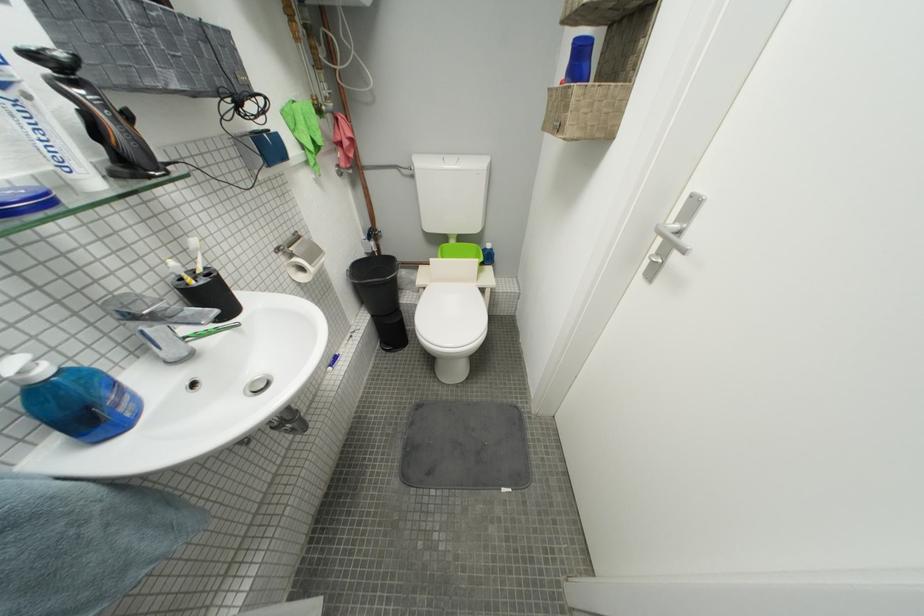
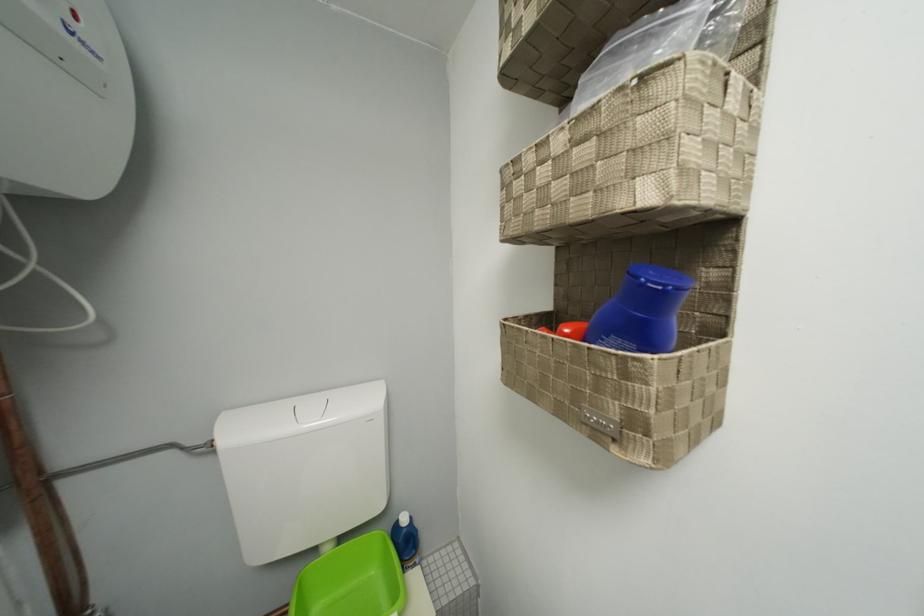
How did the camera likely rotate?

The camera's rotation is toward right-up.